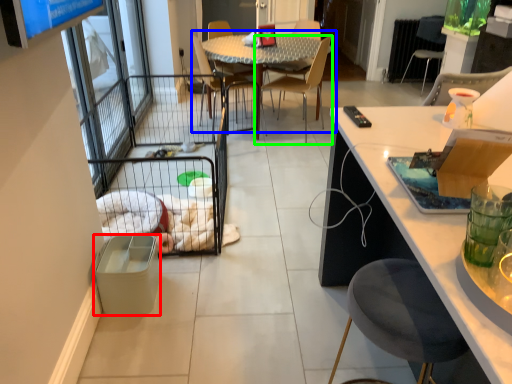
Question: Based on their relative distances, which object is farther from trash bin/can (highlighted by a red box)? Choose from kitchen & dining room table (highlighted by a blue box) and chair (highlighted by a green box).

Choices:
 (A) kitchen & dining room table
 (B) chair

Answer: (B)